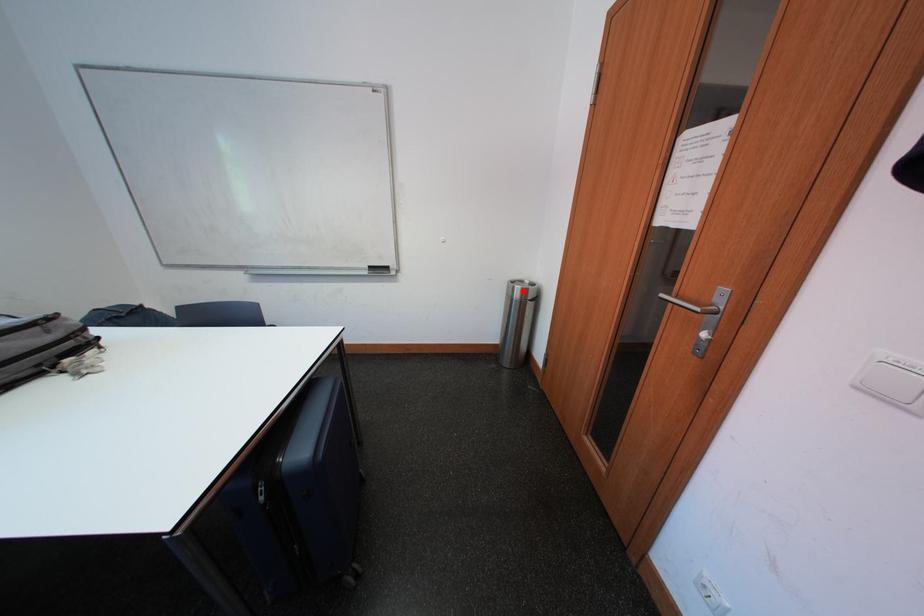
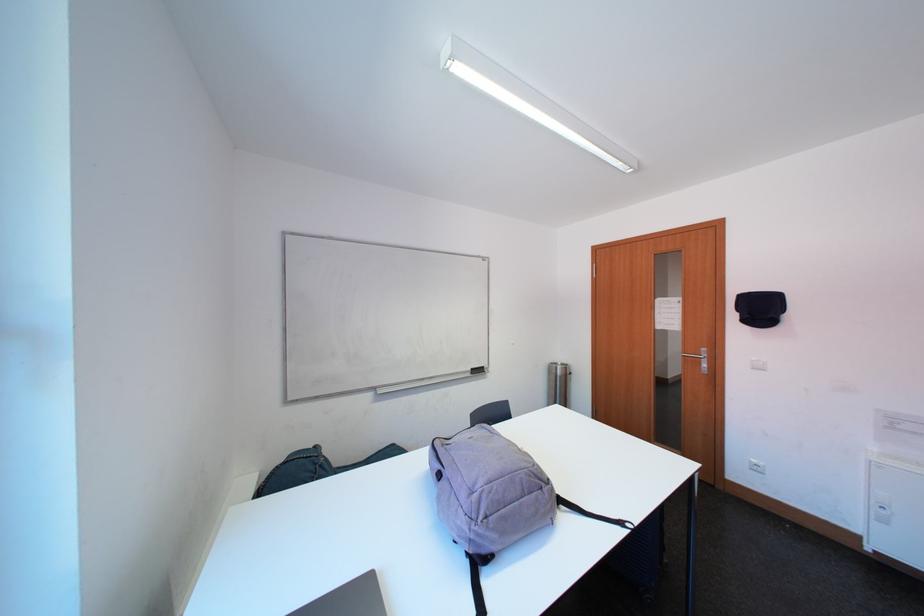
Where in the second image is the point corresponding to the highlighted location from the first image?

(565, 371)